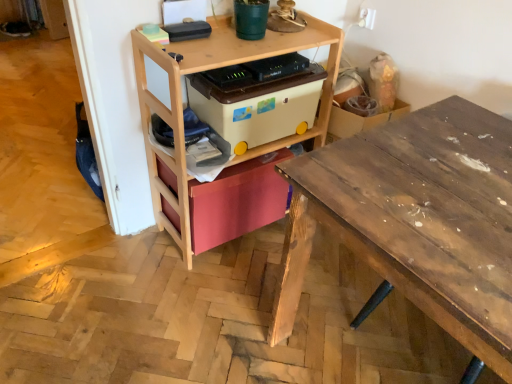
Image resolution: width=512 pixels, height=384 pixels. Describe the element at coordinates (258, 106) in the screenshot. I see `beige plastic storage box at center, acting as the second storage box starting from the bottom` at that location.

Find the location of a particular element. This screenshot has width=512, height=384. matte pink drawer at center, the second storage box from the top is located at coordinates (238, 201).

The image size is (512, 384). What do you see at coordinates (238, 201) in the screenshot? I see `matte pink drawer at center, the second storage box from the top` at bounding box center [238, 201].

You are a GUI agent. You are given a task and a screenshot of the screen. Output one action in this format:
    pyautogui.click(x=<x>, y=<y>)
    Task: Click on the beige plastic storage box at center, which is the 1th storage box from top to bottom
    
    Given the screenshot: What is the action you would take?
    pyautogui.click(x=258, y=106)

Considering the sizes of objects wooden shelf at center and matte pink drawer at center, the second storage box from the top, in the image provided, who is smaller, wooden shelf at center or matte pink drawer at center, the second storage box from the top,?

matte pink drawer at center, the second storage box from the top, is smaller.

Is wooden shelf at center to the left or to the right of matte pink drawer at center, the second storage box from the top, in the image?

Clearly, wooden shelf at center is on the right of matte pink drawer at center, the second storage box from the top, in the image.

Is wooden shelf at center positioned before matte pink drawer at center, the second storage box from the top?

Yes.

Identify the location of the 2nd storage box behind the wooden shelf at center. Image resolution: width=512 pixels, height=384 pixels. (238, 201).

Looking at the image, does wooden desk at right seem bigger or smaller compared to matte pink drawer at center, the first storage box positioned from the bottom?

In the image, wooden desk at right appears to be larger than matte pink drawer at center, the first storage box positioned from the bottom.

From a real-world perspective, is wooden desk at right located beneath matte pink drawer at center, the second storage box from the top?

Incorrect, from a real-world perspective, wooden desk at right is higher than matte pink drawer at center, the second storage box from the top.

Does point (342, 163) appear closer or farther from the camera than point (256, 190)?

Point (342, 163) is positioned closer to the camera compared to point (256, 190).

Is wooden desk at right far from matte pink drawer at center, the second storage box from the top?

No, wooden desk at right is not far away from matte pink drawer at center, the second storage box from the top.

Based on their positions, is beige plastic storage box at center, which is the 1th storage box from top to bottom, located to the left or right of matte pink drawer at center, the second storage box from the top?

From the image, it's evident that beige plastic storage box at center, which is the 1th storage box from top to bottom, is to the right of matte pink drawer at center, the second storage box from the top.

From a real-world perspective, is beige plastic storage box at center, acting as the second storage box starting from the bottom, positioned over matte pink drawer at center, the second storage box from the top, based on gravity?

Yes, from a real-world perspective, beige plastic storage box at center, acting as the second storage box starting from the bottom, is over matte pink drawer at center, the second storage box from the top

Which object is further away from the camera, beige plastic storage box at center, which is the 1th storage box from top to bottom, or matte pink drawer at center, the first storage box positioned from the bottom?

matte pink drawer at center, the first storage box positioned from the bottom, is behind.

Can you tell me how much beige plastic storage box at center, which is the 1th storage box from top to bottom, and matte pink drawer at center, the first storage box positioned from the bottom, differ in facing direction?

The angle between the facing direction of beige plastic storage box at center, which is the 1th storage box from top to bottom, and the facing direction of matte pink drawer at center, the first storage box positioned from the bottom, is 0.652 degrees.

Is wooden shelf at center at the back of beige plastic storage box at center, which is the 1th storage box from top to bottom?

Yes, beige plastic storage box at center, which is the 1th storage box from top to bottom, is positioned with its back facing wooden shelf at center.

From a real-world perspective, is beige plastic storage box at center, acting as the second storage box starting from the bottom, positioned above or below wooden shelf at center?

From a real-world perspective, beige plastic storage box at center, acting as the second storage box starting from the bottom, is physically above wooden shelf at center.

The height and width of the screenshot is (384, 512). Find the location of `shelf that appears below the beige plastic storage box at center, which is the 1th storage box from top to bottom (from a real-world perspective)`. shelf that appears below the beige plastic storage box at center, which is the 1th storage box from top to bottom (from a real-world perspective) is located at coordinates (213, 68).

Measure the distance from beige plastic storage box at center, acting as the second storage box starting from the bottom, to wooden shelf at center.

A distance of 6.05 inches exists between beige plastic storage box at center, acting as the second storage box starting from the bottom, and wooden shelf at center.

From the image's perspective, is matte pink drawer at center, the second storage box from the top, located above wooden shelf at center?

No, from the image's perspective, matte pink drawer at center, the second storage box from the top, is not on top of wooden shelf at center.

Is matte pink drawer at center, the first storage box positioned from the bottom, directly adjacent to wooden shelf at center?

No, matte pink drawer at center, the first storage box positioned from the bottom, is not next to wooden shelf at center.

Is point (246, 194) closer or farther from the camera than point (141, 96)?

Point (246, 194) is positioned farther from the camera compared to point (141, 96).

Is matte pink drawer at center, the first storage box positioned from the bottom, wider or thinner than wooden shelf at center?

In the image, matte pink drawer at center, the first storage box positioned from the bottom, appears to be more narrow than wooden shelf at center.

Is matte pink drawer at center, the second storage box from the top, looking in the opposite direction of wooden desk at right?

No, matte pink drawer at center, the second storage box from the top, is not facing away from wooden desk at right.

Considering the positions of objects matte pink drawer at center, the second storage box from the top, and wooden desk at right in the image provided, who is behind, matte pink drawer at center, the second storage box from the top, or wooden desk at right?

matte pink drawer at center, the second storage box from the top.

From a real-world perspective, is matte pink drawer at center, the first storage box positioned from the bottom, positioned under wooden desk at right based on gravity?

Indeed, from a real-world perspective, matte pink drawer at center, the first storage box positioned from the bottom, is positioned beneath wooden desk at right.

Are wooden shelf at center and beige plastic storage box at center, which is the 1th storage box from top to bottom, making contact?

There is a gap between wooden shelf at center and beige plastic storage box at center, which is the 1th storage box from top to bottom.

Which object is closer to the camera taking this photo, wooden shelf at center or beige plastic storage box at center, which is the 1th storage box from top to bottom?

wooden shelf at center is closer to the camera.

Considering the sizes of objects wooden shelf at center and beige plastic storage box at center, which is the 1th storage box from top to bottom, in the image provided, who is thinner, wooden shelf at center or beige plastic storage box at center, which is the 1th storage box from top to bottom,?

wooden shelf at center.

From a real-world perspective, is wooden shelf at center physically located above or below beige plastic storage box at center, acting as the second storage box starting from the bottom?

wooden shelf at center is situated lower than beige plastic storage box at center, acting as the second storage box starting from the bottom, in the real world.

This screenshot has width=512, height=384. What are the coordinates of `shelf above the matte pink drawer at center, the first storage box positioned from the bottom (from the image's perspective)` in the screenshot? It's located at (213, 68).

Where is `desk in front of the matte pink drawer at center, the first storage box positioned from the bottom`? Image resolution: width=512 pixels, height=384 pixels. desk in front of the matte pink drawer at center, the first storage box positioned from the bottom is located at coordinates (416, 221).

When comparing their distances from beige plastic storage box at center, which is the 1th storage box from top to bottom, does wooden shelf at center or wooden desk at right seem further?

wooden desk at right.

Estimate the real-world distances between objects in this image. Which object is closer to wooden desk at right, wooden shelf at center or matte pink drawer at center, the second storage box from the top?

Among the two, matte pink drawer at center, the second storage box from the top, is located nearer to wooden desk at right.

Based on their spatial positions, is matte pink drawer at center, the first storage box positioned from the bottom, or wooden shelf at center further from wooden desk at right?

Based on the image, wooden shelf at center appears to be further to wooden desk at right.

From the image, which object appears to be nearer to matte pink drawer at center, the first storage box positioned from the bottom, beige plastic storage box at center, acting as the second storage box starting from the bottom, or wooden desk at right?

Among the two, beige plastic storage box at center, acting as the second storage box starting from the bottom, is located nearer to matte pink drawer at center, the first storage box positioned from the bottom.

Based on their spatial positions, is matte pink drawer at center, the first storage box positioned from the bottom, or wooden desk at right closer to beige plastic storage box at center, acting as the second storage box starting from the bottom?

Based on the image, matte pink drawer at center, the first storage box positioned from the bottom, appears to be nearer to beige plastic storage box at center, acting as the second storage box starting from the bottom.

When comparing their distances from matte pink drawer at center, the second storage box from the top, does wooden desk at right or beige plastic storage box at center, acting as the second storage box starting from the bottom, seem further?

Based on the image, wooden desk at right appears to be further to matte pink drawer at center, the second storage box from the top.

Looking at the image, which one is located further to wooden shelf at center, matte pink drawer at center, the second storage box from the top, or beige plastic storage box at center, acting as the second storage box starting from the bottom?

Result: Based on the image, matte pink drawer at center, the second storage box from the top, appears to be further to wooden shelf at center.

Considering their positions, is beige plastic storage box at center, which is the 1th storage box from top to bottom, positioned further to matte pink drawer at center, the first storage box positioned from the bottom, than wooden shelf at center?

beige plastic storage box at center, which is the 1th storage box from top to bottom, lies further to matte pink drawer at center, the first storage box positioned from the bottom, than the other object.

Locate an element on the screen. Image resolution: width=512 pixels, height=384 pixels. shelf between wooden desk at right and beige plastic storage box at center, which is the 1th storage box from top to bottom, along the z-axis is located at coordinates (213, 68).

Identify the location of storage box located between wooden desk at right and matte pink drawer at center, the first storage box positioned from the bottom, in the depth direction. This screenshot has width=512, height=384. (258, 106).

Where is `shelf between wooden desk at right and matte pink drawer at center, the second storage box from the top, from front to back`? The width and height of the screenshot is (512, 384). shelf between wooden desk at right and matte pink drawer at center, the second storage box from the top, from front to back is located at coordinates (213, 68).

Find the location of `shelf between beige plastic storage box at center, which is the 1th storage box from top to bottom, and matte pink drawer at center, the first storage box positioned from the bottom, in the up-down direction`. shelf between beige plastic storage box at center, which is the 1th storage box from top to bottom, and matte pink drawer at center, the first storage box positioned from the bottom, in the up-down direction is located at coordinates (213, 68).